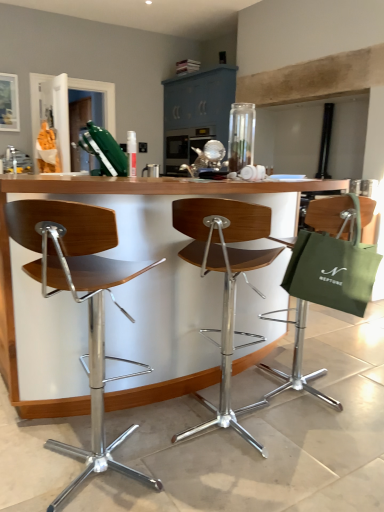
Question: Is wooden seat at center, which is counted as the second chair, starting from the left, wider or thinner than wooden seat at center, positioned as the first chair in left-to-right order?

Choices:
 (A) wide
 (B) thin

Answer: (B)

Question: Is wooden seat at center, which is counted as the second chair, starting from the left, inside or outside of wooden seat at center, positioned as the first chair in left-to-right order?

Choices:
 (A) outside
 (B) inside

Answer: (A)

Question: Which of these objects is positioned farthest from the green canvas tote at right?

Choices:
 (A) wooden seat at center, which is counted as the second chair, starting from the left
 (B) woodenmaterial/texturetable at center
 (C) green fabric bag at right, which appears as the first chair when viewed from the right
 (D) wooden seat at center, acting as the third chair starting from the right

Answer: (D)

Question: Considering the real-world distances, which object is closest to the woodenmaterial/texturetable at center?

Choices:
 (A) green canvas tote at right
 (B) green fabric bag at right, which appears as the first chair when viewed from the right
 (C) wooden seat at center, which is counted as the second chair, starting from the left
 (D) wooden seat at center, acting as the third chair starting from the right

Answer: (D)